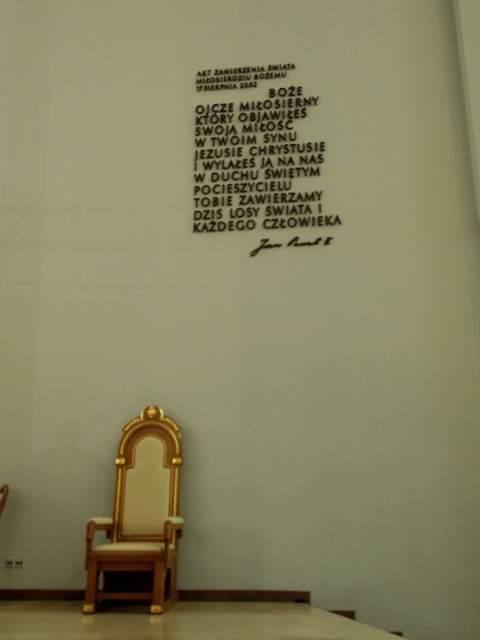
You are an interior designer planning to hang a small decorative item on the wall. You have a golden throne chair in the room. There is a point marked at coordinates (257, 161). Where exactly is this point located in relation to the golden throne chair?

The point marked at coordinates (257, 161) is on the black paper at upper center, which is above the golden throne chair.

You are an interior designer assessing the proportions of furniture in a room. The gold wood throne at center and the wooden polished chair at lower left are part of the design. Which piece of furniture is taller?

The gold wood throne at center is taller than the wooden polished chair at lower left according to the description.